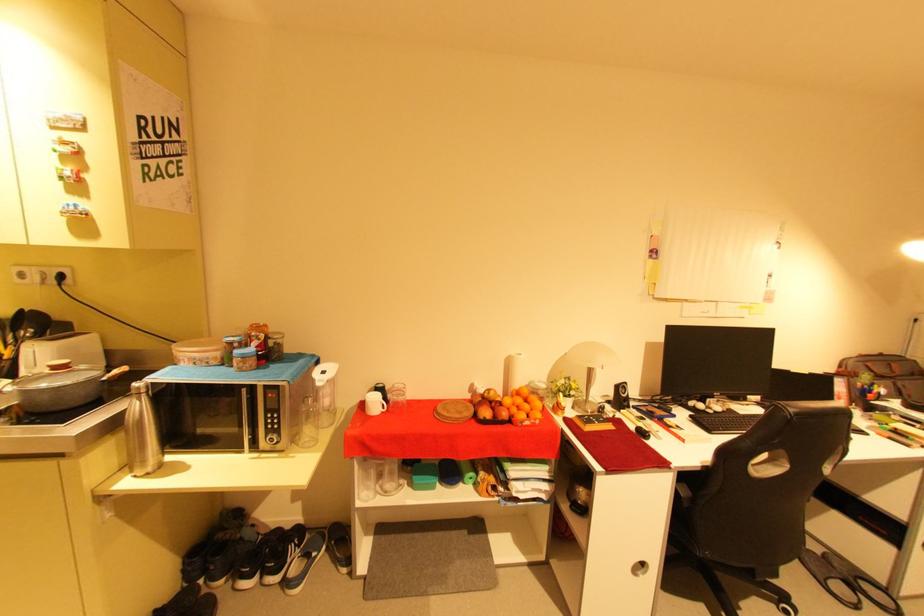
Where would you push the microwave button? Please return your answer as a coordinate pair (x, y).

(272, 426)